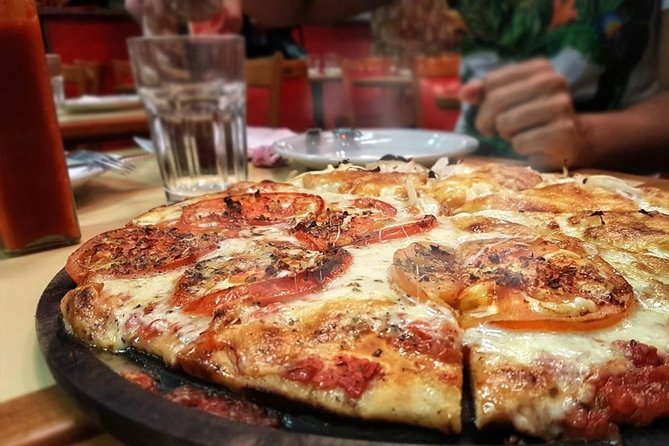
The height and width of the screenshot is (446, 669). I want to click on fork, so click(x=118, y=167).